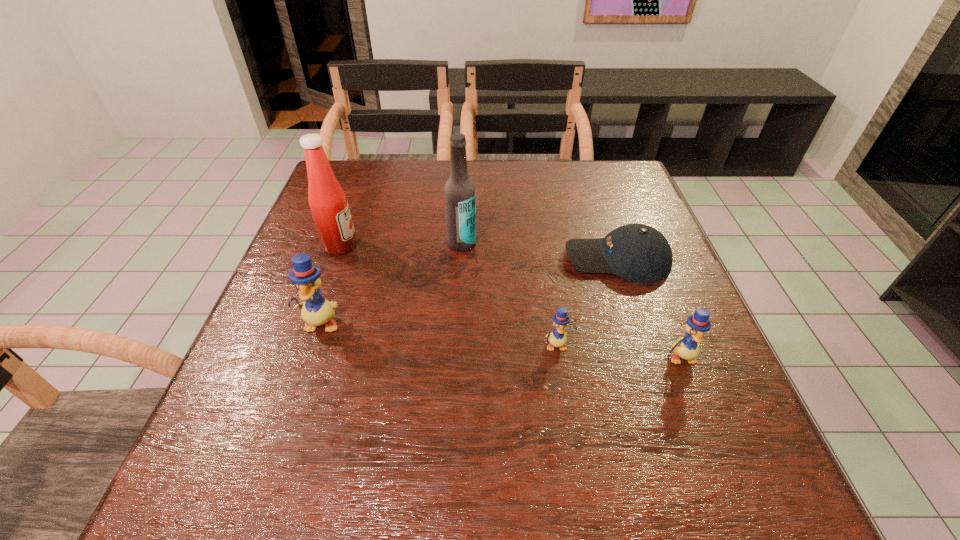
You are a GUI agent. You are given a task and a screenshot of the screen. Output one action in this format:
    pyautogui.click(x=<x>, y=<y>)
    Task: Click on the baseball cap located at the right edge
    
    Given the screenshot: What is the action you would take?
    (x=638, y=253)

Find the location of a particular element. vacant area at the far edge of the desktop is located at coordinates (568, 170).

Image resolution: width=960 pixels, height=540 pixels. I want to click on vacant space at the near edge of the desktop, so click(x=566, y=390).

The image size is (960, 540). In the image, there is a desktop. Find the location of `vacant space at the left edge`. vacant space at the left edge is located at coordinates (300, 333).

Where is `free space at the right edge of the desktop`? The width and height of the screenshot is (960, 540). free space at the right edge of the desktop is located at coordinates (636, 284).

Identify the location of free space at the far right corner of the desktop. (615, 167).

The width and height of the screenshot is (960, 540). What are the coordinates of `free space that is in between the second duckling from left to right and the fourth object from right to left` in the screenshot? It's located at (509, 294).

I want to click on vacant area that lies between the fourth tallest object and the third object from right to left, so click(618, 352).

This screenshot has height=540, width=960. Find the location of `empty location between the third nearest object and the rightmost duckling`. empty location between the third nearest object and the rightmost duckling is located at coordinates (501, 340).

At what (x,y) coordinates should I click in order to perform the action: click on empty location between the second tallest duckling and the farthest duckling. Please return your answer as a coordinate pair (x, y). The width and height of the screenshot is (960, 540). Looking at the image, I should click on (501, 340).